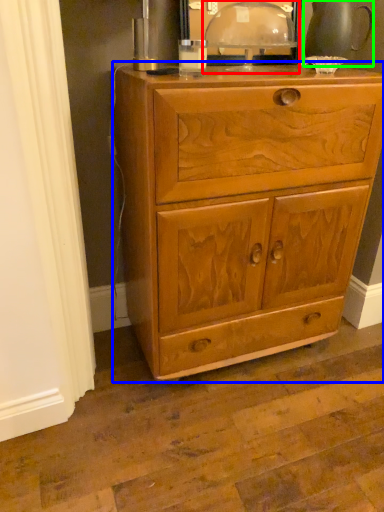
Question: Considering the real-world distances, which object is farthest from table lamp (highlighted by a red box)? chest of drawers (highlighted by a blue box) or tea pot (highlighted by a green box)?

Choices:
 (A) chest of drawers
 (B) tea pot

Answer: (A)